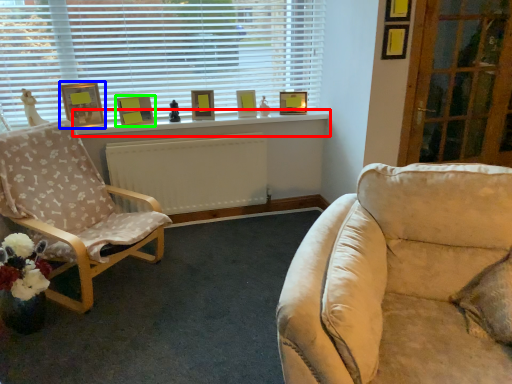
Question: Which object is the farthest from window sill (highlighted by a red box)? Choose among these: picture frame (highlighted by a blue box) or picture frame (highlighted by a green box).

Choices:
 (A) picture frame
 (B) picture frame

Answer: (A)